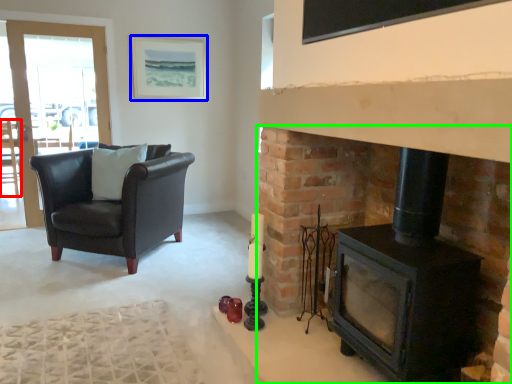
Question: Based on their relative distances, which object is nearer to chair (highlighted by a red box)? Choose from picture frame (highlighted by a blue box) and fireplace (highlighted by a green box).

Choices:
 (A) picture frame
 (B) fireplace

Answer: (A)